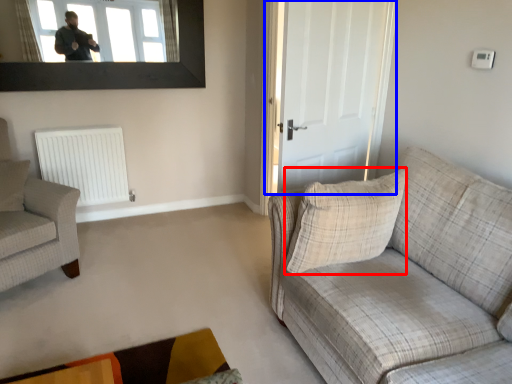
Question: Which object appears closest to the camera in this image, pillow (highlighted by a red box) or door (highlighted by a blue box)?

Choices:
 (A) pillow
 (B) door

Answer: (A)